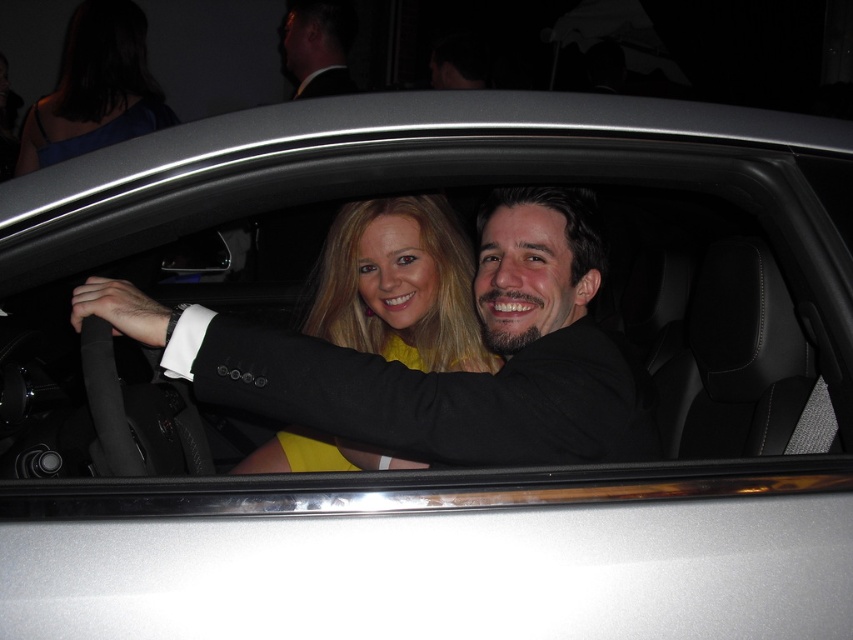
Question: Can you confirm if yellow matte dress at center is bigger than blue satin dress at upper left?

Choices:
 (A) no
 (B) yes

Answer: (A)

Question: Is blue satin dress at upper left wider than black suit at upper left?

Choices:
 (A) no
 (B) yes

Answer: (B)

Question: Among these objects, which one is nearest to the camera?

Choices:
 (A) black suit at upper left
 (B) yellow matte dress at center

Answer: (B)

Question: Can you confirm if blue satin dress at upper left is positioned above black suit at upper left?

Choices:
 (A) yes
 (B) no

Answer: (B)

Question: Among these objects, which one is farthest from the camera?

Choices:
 (A) black suit at upper left
 (B) blue satin dress at upper left

Answer: (A)

Question: Considering the real-world distances, which object is farthest from the yellow matte dress at center?

Choices:
 (A) black suit at upper left
 (B) blue satin dress at upper left

Answer: (A)